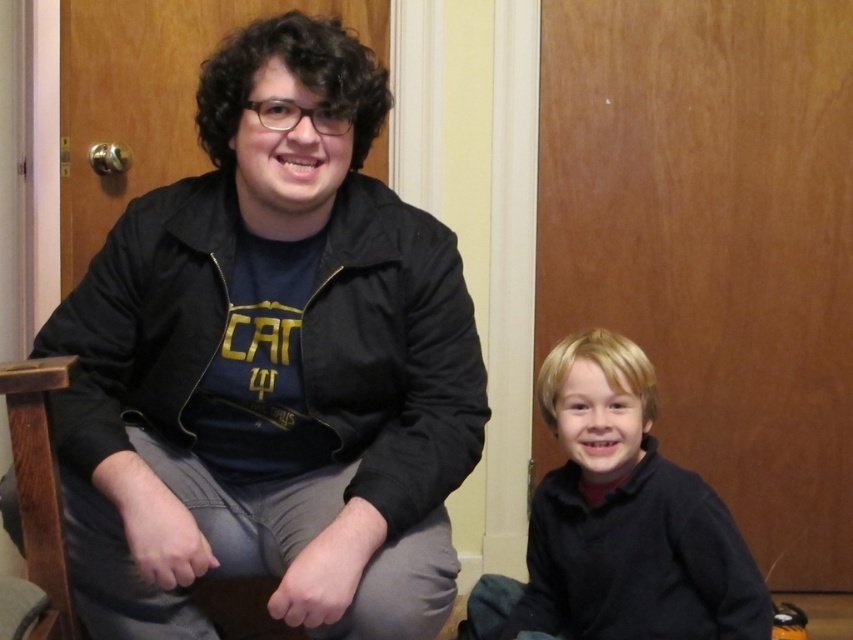
Is black matte jacket at left closer to camera compared to wooden textured rocking chair at left?

Yes, it is in front of wooden textured rocking chair at left.

This screenshot has width=853, height=640. In order to click on black matte jacket at left in this screenshot , I will do `click(270, 365)`.

At what (x,y) coordinates should I click in order to perform the action: click on black matte jacket at left. Please return your answer as a coordinate pair (x, y). Looking at the image, I should click on (270, 365).

Can you confirm if black matte jacket at left is wider than black matte sweater at lower right?

Correct, the width of black matte jacket at left exceeds that of black matte sweater at lower right.

Between black matte jacket at left and black matte sweater at lower right, which one is positioned higher?

black matte jacket at left

This screenshot has height=640, width=853. In order to click on black matte jacket at left in this screenshot , I will do `click(270, 365)`.

Find the location of a particular element. The image size is (853, 640). black matte jacket at left is located at coordinates (270, 365).

Can you confirm if black matte sweater at lower right is bigger than wooden textured rocking chair at left?

Indeed, black matte sweater at lower right has a larger size compared to wooden textured rocking chair at left.

Is point (714, 636) behind point (38, 529)?

Yes, point (714, 636) is farther from viewer.

Where is `black matte sweater at lower right`? This screenshot has height=640, width=853. black matte sweater at lower right is located at coordinates (625, 516).

Where is `black matte sweater at lower right`? black matte sweater at lower right is located at coordinates (625, 516).